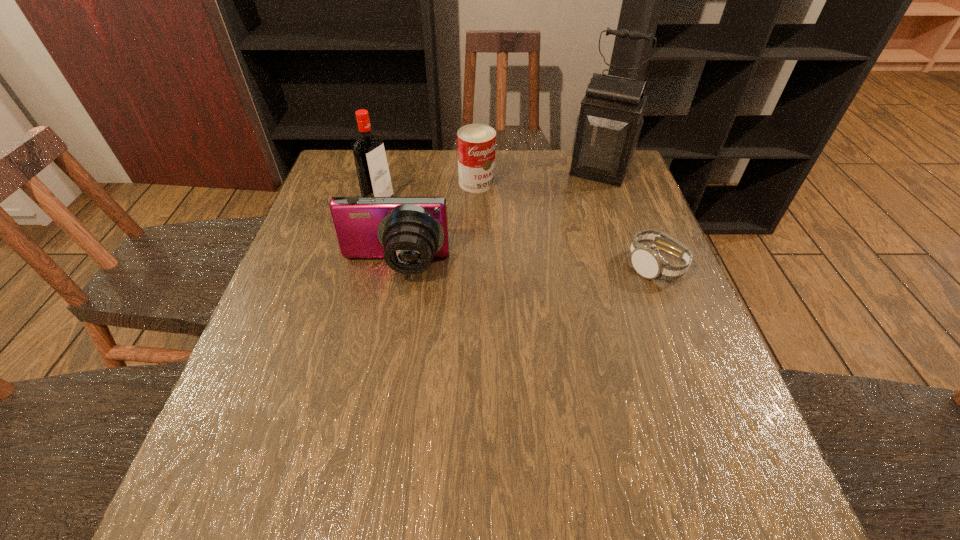
Where is `camera that is positioned at the left edge`? camera that is positioned at the left edge is located at coordinates (408, 232).

Image resolution: width=960 pixels, height=540 pixels. I want to click on vodka that is positioned at the left edge, so click(373, 174).

Locate an element on the screen. watch that is positioned at the right edge is located at coordinates (647, 261).

The height and width of the screenshot is (540, 960). What are the coordinates of `lantern at the right edge` in the screenshot? It's located at (608, 127).

The width and height of the screenshot is (960, 540). I want to click on object that is at the far left corner, so click(373, 174).

At what (x,y) coordinates should I click in order to perform the action: click on object that is at the far right corner. Please return your answer as a coordinate pair (x, y). Looking at the image, I should click on (608, 127).

Where is `vacant space at the far edge of the desktop`? The height and width of the screenshot is (540, 960). vacant space at the far edge of the desktop is located at coordinates (578, 178).

This screenshot has height=540, width=960. I want to click on blank area at the near edge, so click(x=405, y=424).

I want to click on blank space at the left edge of the desktop, so click(264, 346).

Where is `vacant space at the right edge`? vacant space at the right edge is located at coordinates click(x=636, y=353).